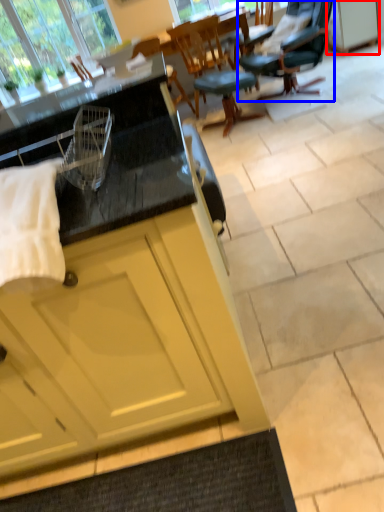
Question: Which point is closer to the camera, cabinetry (highlighted by a red box) or chair (highlighted by a blue box)?

Choices:
 (A) cabinetry
 (B) chair

Answer: (B)